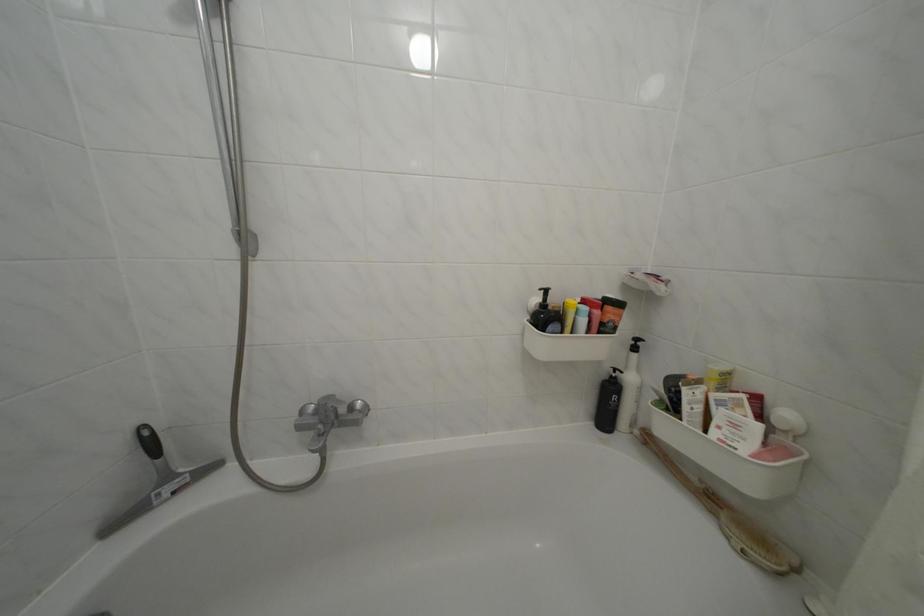
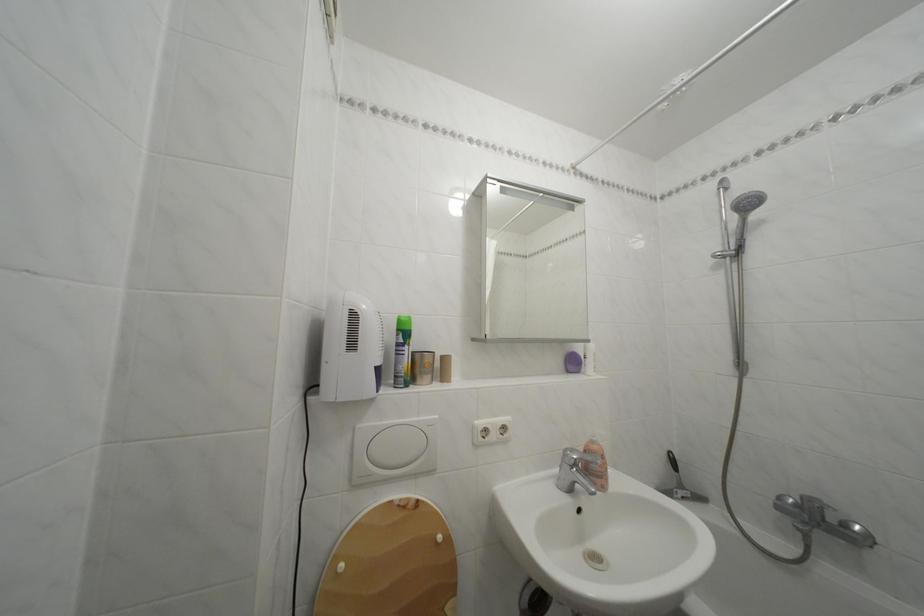
In the second image, find the point that corresponds to (176,484) in the first image.

(689, 492)